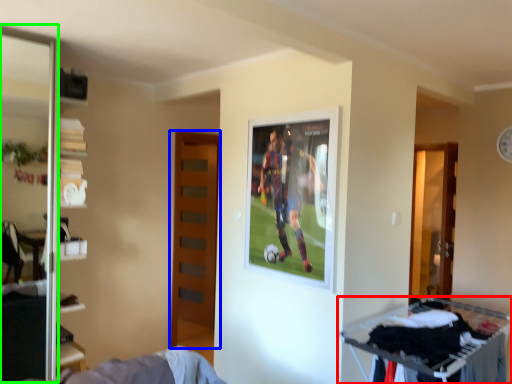
Question: Considering the real-world distances, which object is farthest from furniture (highlighted by a red box)? door (highlighted by a blue box) or screen door (highlighted by a green box)?

Choices:
 (A) door
 (B) screen door

Answer: (B)